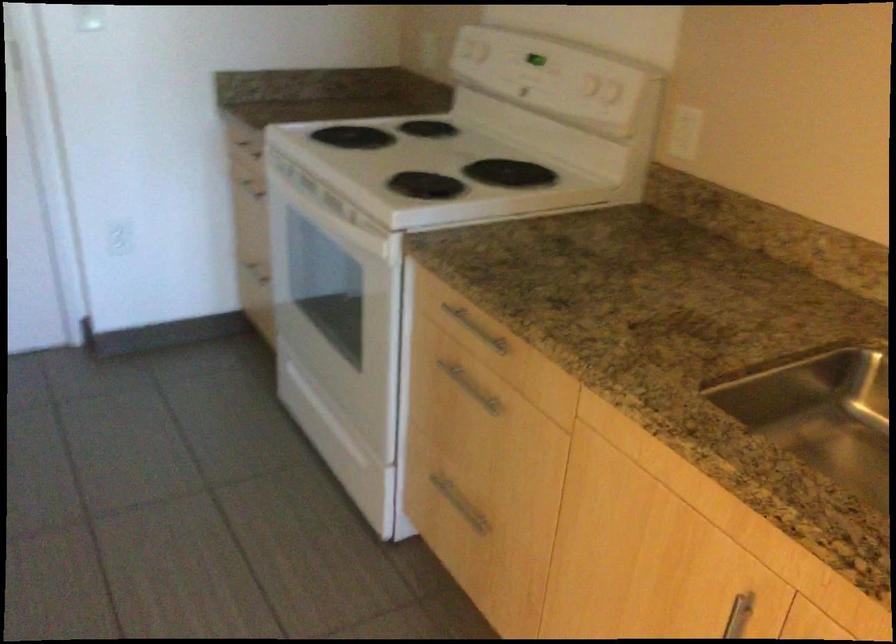
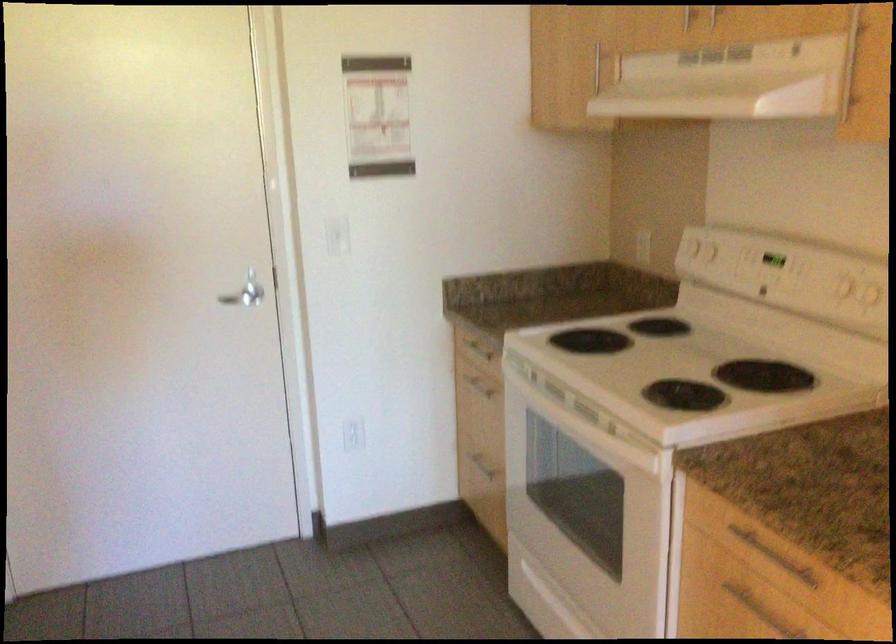
The point at (x=251, y=149) is marked in the first image. Where is the corresponding point in the second image?

(476, 346)